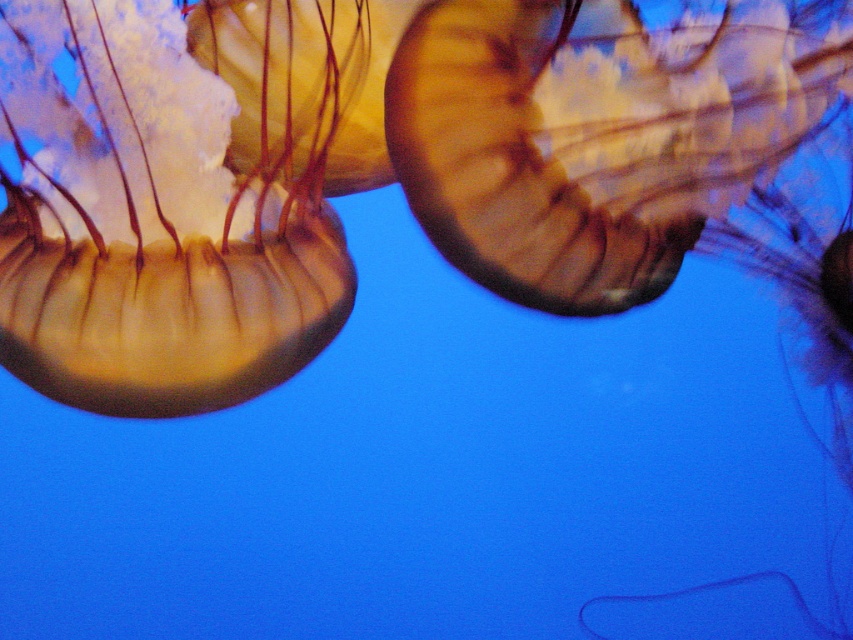
Question: Which point is farther to the camera?

Choices:
 (A) translucent gelatinous at upper right
 (B) translucent gelatinous at left

Answer: (A)

Question: Where is translucent gelatinous at left located in relation to translucent gelatinous at upper right in the image?

Choices:
 (A) right
 (B) left

Answer: (B)

Question: Which object is farther from the camera taking this photo?

Choices:
 (A) translucent gelatinous at upper right
 (B) translucent gelatinous at left

Answer: (A)

Question: Does translucent gelatinous at left have a larger size compared to translucent gelatinous at upper right?

Choices:
 (A) no
 (B) yes

Answer: (B)

Question: Can you confirm if translucent gelatinous at left is thinner than translucent gelatinous at upper right?

Choices:
 (A) no
 (B) yes

Answer: (B)